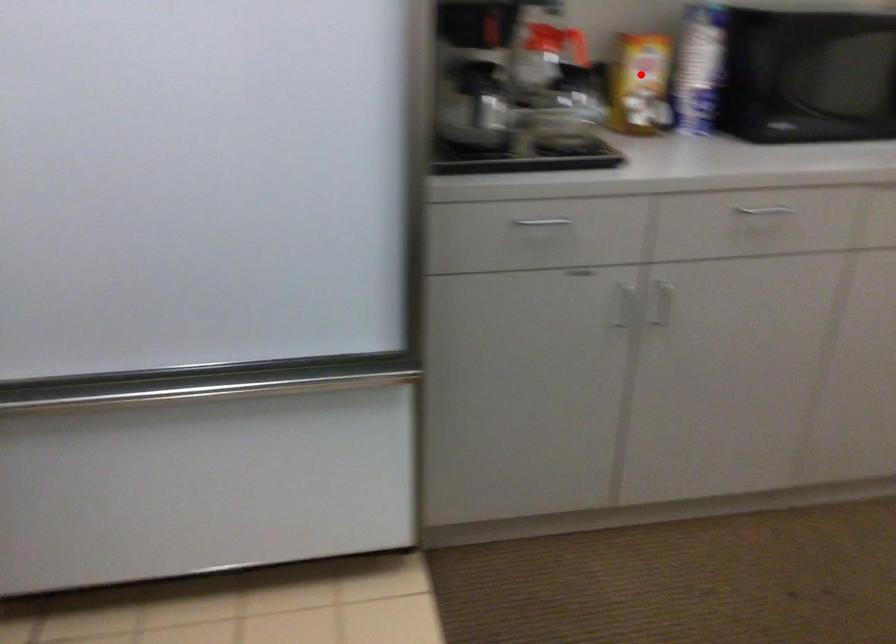
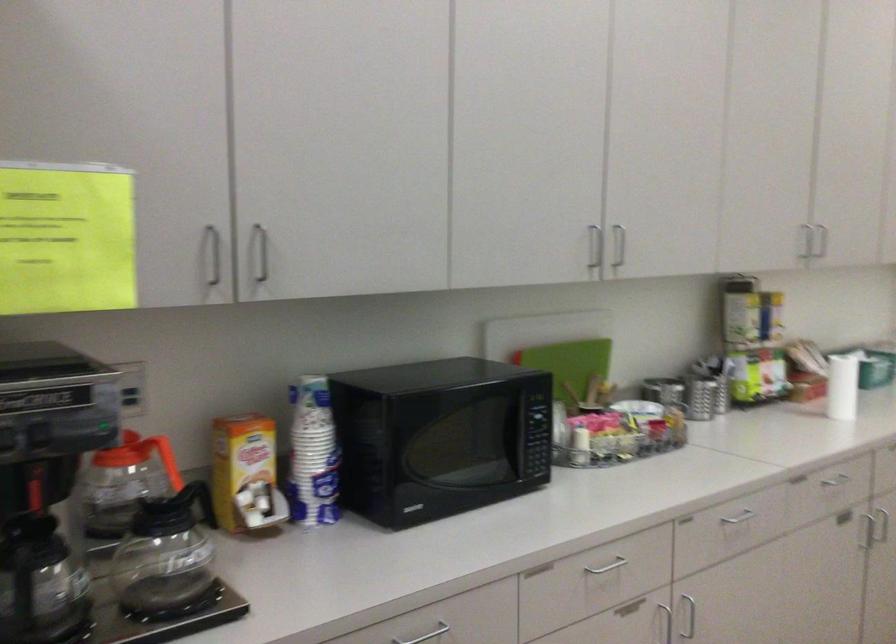
Question: I am providing you with two images of the same scene from different viewpoints. In image1, a red point is highlighted. Considering the same 3D point in image2, which of the following is correct?

Choices:
 (A) It is closer
 (B) It is farther

Answer: (A)